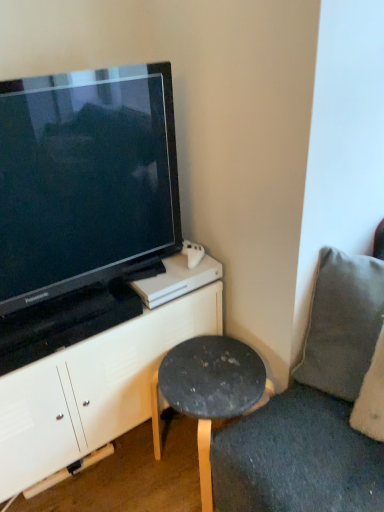
At what (x,y) coordinates should I click in order to perform the action: click on white matte cabinet at upper left. Please return your answer as a coordinate pair (x, y). Looking at the image, I should click on (94, 390).

What do you see at coordinates (211, 389) in the screenshot? I see `dark gray stone stool at lower right` at bounding box center [211, 389].

The width and height of the screenshot is (384, 512). What do you see at coordinates (342, 323) in the screenshot?
I see `gray fabric pillow at right` at bounding box center [342, 323].

Identify the location of white matte cabinet at upper left. This screenshot has height=512, width=384. (94, 390).

How different are the orientations of gray fabric pillow at right and white matte cabinet at upper left in degrees?

61.9 degrees.

Considering the relative sizes of gray fabric pillow at right and white matte cabinet at upper left in the image provided, is gray fabric pillow at right shorter than white matte cabinet at upper left?

Yes, gray fabric pillow at right is shorter than white matte cabinet at upper left.

Can you confirm if gray fabric pillow at right is bigger than white matte cabinet at upper left?

Incorrect, gray fabric pillow at right is not larger than white matte cabinet at upper left.

Does point (336, 338) lie in front of point (55, 418)?

Yes, it is.

Is point (73, 353) positioned before point (322, 354)?

Yes, it is in front of point (322, 354).

Does white matte cabinet at upper left turn towards gray fabric pillow at right?

Yes, white matte cabinet at upper left is aimed at gray fabric pillow at right.

Can you tell me how much white matte cabinet at upper left and gray fabric pillow at right differ in facing direction?

They differ by 61.9 degrees in their facing directions.

Considering the sizes of white matte cabinet at upper left and gray fabric pillow at right in the image, is white matte cabinet at upper left bigger or smaller than gray fabric pillow at right?

white matte cabinet at upper left is bigger than gray fabric pillow at right.

Is black glossy television at upper left turned away from dark gray stone stool at lower right?

No, black glossy television at upper left is not facing away from dark gray stone stool at lower right.

From a real-world perspective, who is located higher, black glossy television at upper left or dark gray stone stool at lower right?

In real-world perspective, black glossy television at upper left is above.

Looking at the image, does black glossy television at upper left seem bigger or smaller compared to dark gray stone stool at lower right?

Clearly, black glossy television at upper left is larger in size than dark gray stone stool at lower right.

Is dark gray stone stool at lower right a part of gray fabric pillow at right?

No, dark gray stone stool at lower right is not surrounded by gray fabric pillow at right.

The width and height of the screenshot is (384, 512). Find the location of `pillow above the dark gray stone stool at lower right (from the image's perspective)`. pillow above the dark gray stone stool at lower right (from the image's perspective) is located at coordinates (342, 323).

Looking at this image, which of these two, gray fabric pillow at right or dark gray stone stool at lower right, stands taller?

dark gray stone stool at lower right is taller.

Does dark gray stone stool at lower right have a greater width compared to black glossy television at upper left?

Yes.

Measure the distance between dark gray stone stool at lower right and black glossy television at upper left.

They are 22.25 inches apart.

Is dark gray stone stool at lower right placed right next to black glossy television at upper left?

No, dark gray stone stool at lower right is not touching black glossy television at upper left.

The image size is (384, 512). I want to click on stool that appears below the black glossy television at upper left (from a real-world perspective), so click(x=211, y=389).

Can black glossy television at upper left be found inside white matte cabinet at upper left?

That's incorrect, black glossy television at upper left is not inside white matte cabinet at upper left.

Considering the sizes of white matte cabinet at upper left and black glossy television at upper left in the image, is white matte cabinet at upper left bigger or smaller than black glossy television at upper left?

In the image, white matte cabinet at upper left appears to be larger than black glossy television at upper left.

Consider the image. Are white matte cabinet at upper left and black glossy television at upper left located far from each other?

No, white matte cabinet at upper left is not far away from black glossy television at upper left.

How distant is white matte cabinet at upper left from black glossy television at upper left?

white matte cabinet at upper left and black glossy television at upper left are 15.43 inches apart.

From a real-world perspective, does gray fabric pillow at right sit lower than black glossy television at upper left?

Yes, from a real-world perspective, gray fabric pillow at right is under black glossy television at upper left.

Is gray fabric pillow at right turned away from black glossy television at upper left?

gray fabric pillow at right is not turned away from black glossy television at upper left.

Which of these two, gray fabric pillow at right or black glossy television at upper left, is smaller?

gray fabric pillow at right is smaller.

Which is more to the left, gray fabric pillow at right or black glossy television at upper left?

black glossy television at upper left.

You are a GUI agent. You are given a task and a screenshot of the screen. Output one action in this format:
    pyautogui.click(x=<x>, y=<y>)
    Task: Click on the pillow on the right of white matte cabinet at upper left
    This screenshot has height=512, width=384.
    Given the screenshot: What is the action you would take?
    pyautogui.click(x=342, y=323)

Where is `cabinetry behind the gray fabric pillow at right`? The height and width of the screenshot is (512, 384). cabinetry behind the gray fabric pillow at right is located at coordinates click(x=94, y=390).

In the scene shown: Which object lies further to the anchor point white matte cabinet at upper left, black glossy television at upper left or gray fabric pillow at right?

Among the two, gray fabric pillow at right is located further to white matte cabinet at upper left.

Considering their positions, is black glossy television at upper left positioned further to gray fabric pillow at right than white matte cabinet at upper left?

black glossy television at upper left is further to gray fabric pillow at right.

Based on their spatial positions, is black glossy television at upper left or dark gray stone stool at lower right further from gray fabric pillow at right?

Among the two, black glossy television at upper left is located further to gray fabric pillow at right.

Consider the image. Considering their positions, is dark gray stone stool at lower right positioned further to black glossy television at upper left than white matte cabinet at upper left?

dark gray stone stool at lower right.

Looking at the image, which one is located closer to gray fabric pillow at right, white matte cabinet at upper left or black glossy television at upper left?

Among the two, white matte cabinet at upper left is located nearer to gray fabric pillow at right.

Which object lies further to the anchor point white matte cabinet at upper left, gray fabric pillow at right or dark gray stone stool at lower right?

gray fabric pillow at right is further to white matte cabinet at upper left.

Estimate the real-world distances between objects in this image. Which object is closer to black glossy television at upper left, white matte cabinet at upper left or dark gray stone stool at lower right?

Among the two, white matte cabinet at upper left is located nearer to black glossy television at upper left.

Based on their spatial positions, is gray fabric pillow at right or dark gray stone stool at lower right further from black glossy television at upper left?

Based on the image, gray fabric pillow at right appears to be further to black glossy television at upper left.

Identify the location of television between white matte cabinet at upper left and gray fabric pillow at right in the horizontal direction. (85, 179).

Identify the location of cabinetry between black glossy television at upper left and dark gray stone stool at lower right vertically. The height and width of the screenshot is (512, 384). (94, 390).

This screenshot has height=512, width=384. In order to click on stool located between black glossy television at upper left and gray fabric pillow at right in the left-right direction in this screenshot , I will do `click(211, 389)`.

I want to click on stool between white matte cabinet at upper left and gray fabric pillow at right from left to right, so click(211, 389).